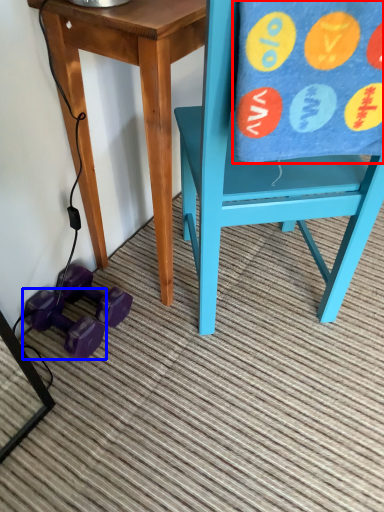
Question: Which object appears farthest to the camera in this image, beach towel (highlighted by a red box) or dumbbell (highlighted by a blue box)?

Choices:
 (A) beach towel
 (B) dumbbell

Answer: (B)